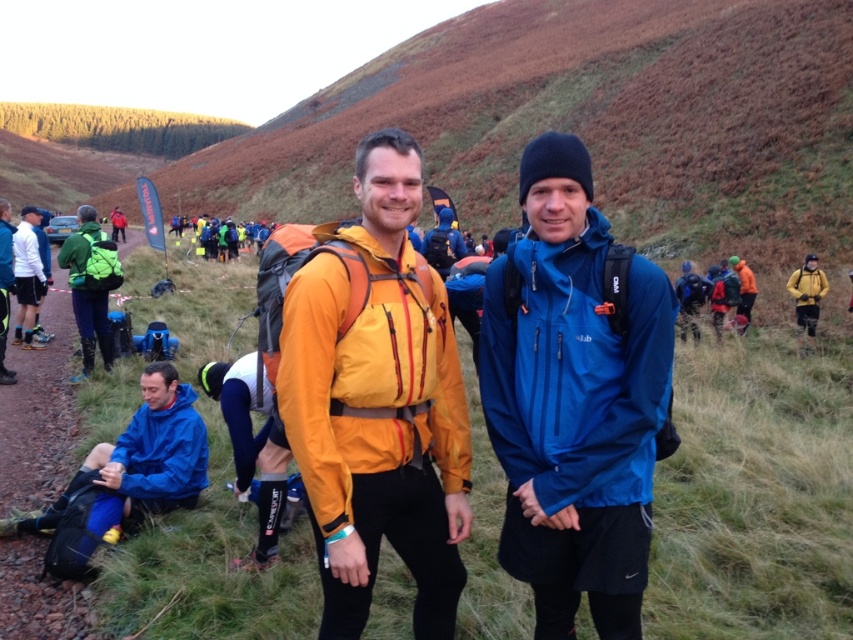
Can you confirm if matte yellow jacket at center is positioned to the right of blue matte jacket at lower left?

Correct, you'll find matte yellow jacket at center to the right of blue matte jacket at lower left.

Consider the image. Is matte yellow jacket at center below blue matte jacket at lower left?

Actually, matte yellow jacket at center is above blue matte jacket at lower left.

Identify the location of matte yellow jacket at center. The image size is (853, 640). (x=376, y=403).

Can you confirm if blue waterproof jacket at center is smaller than blue matte jacket at lower left?

Actually, blue waterproof jacket at center might be larger than blue matte jacket at lower left.

Between blue waterproof jacket at center and blue matte jacket at lower left, which one is positioned lower?

blue matte jacket at lower left is lower down.

Image resolution: width=853 pixels, height=640 pixels. What do you see at coordinates (573, 396) in the screenshot?
I see `blue waterproof jacket at center` at bounding box center [573, 396].

Locate an element on the screen. blue waterproof jacket at center is located at coordinates (573, 396).

Is point (544, 173) in front of point (300, 451)?

No, it is not.

Between blue waterproof jacket at center and matte yellow jacket at center, which one has more height?

matte yellow jacket at center is taller.

You are a GUI agent. You are given a task and a screenshot of the screen. Output one action in this format:
    pyautogui.click(x=<x>, y=<y>)
    Task: Click on the blue waterproof jacket at center
    This screenshot has width=853, height=640.
    Given the screenshot: What is the action you would take?
    pyautogui.click(x=573, y=396)

Where is `blue waterproof jacket at center`? The width and height of the screenshot is (853, 640). blue waterproof jacket at center is located at coordinates (573, 396).